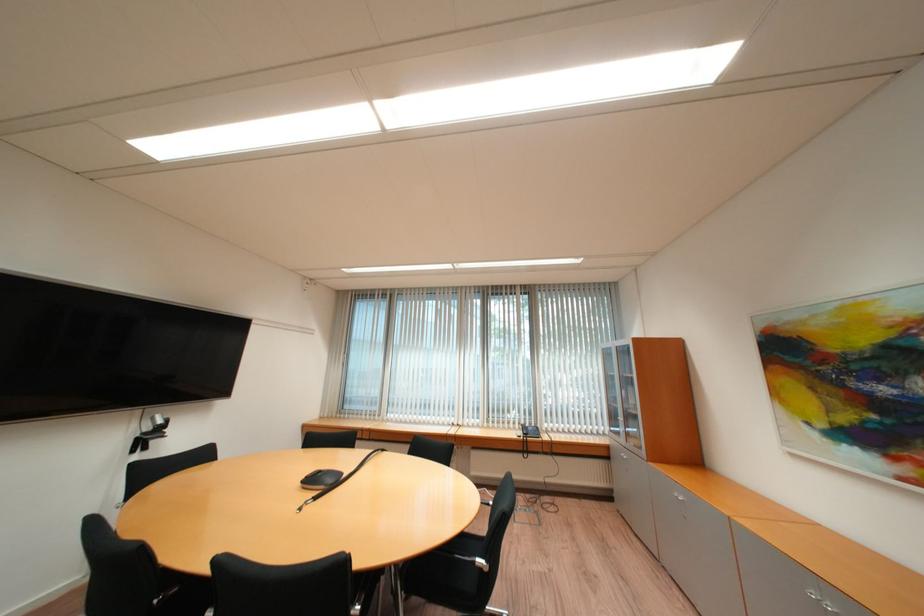
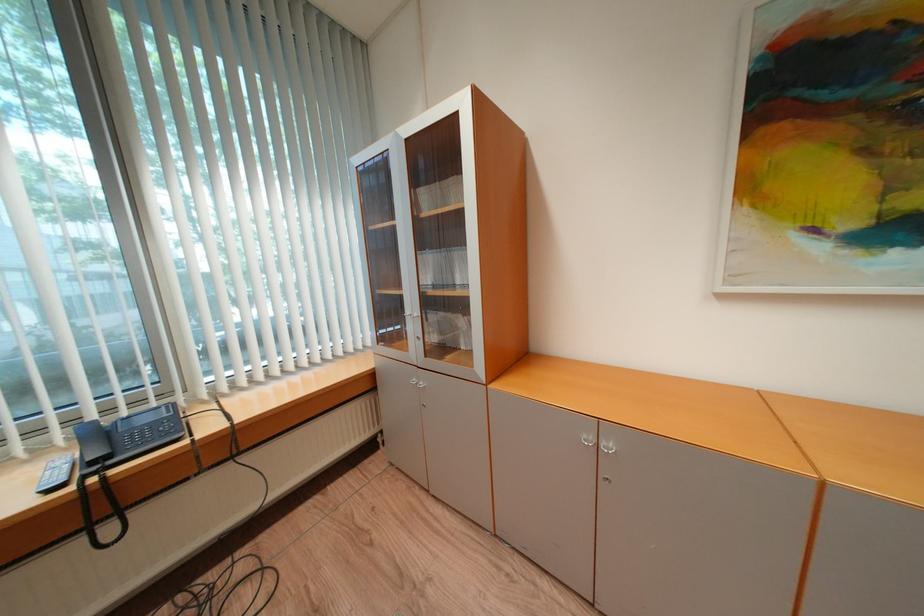
The point at (532,429) is marked in the first image. Where is the corresponding point in the second image?

(104, 434)